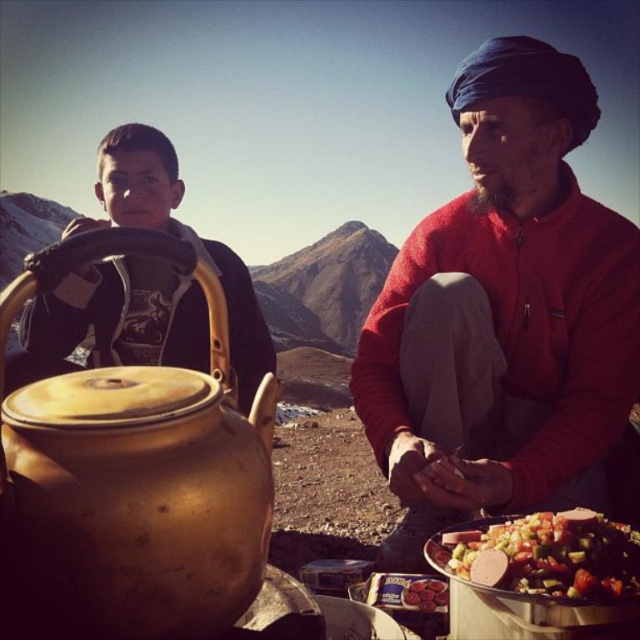
How much distance is there between gold matte teapot at left and matte black jacket at left?

A distance of 3.39 meters exists between gold matte teapot at left and matte black jacket at left.

Between point (20, 412) and point (99, 330), which one is positioned in front?

Positioned in front is point (20, 412).

Where is `gold matte teapot at left`? The image size is (640, 640). gold matte teapot at left is located at coordinates (140, 474).

At what (x,y) coordinates should I click in order to perform the action: click on red wool sweater at center. Please return your answer as a coordinate pair (x, y). Looking at the image, I should click on (x=504, y=314).

Which is more to the right, red wool sweater at center or matte black jacket at left?

red wool sweater at center is more to the right.

Between point (524, 365) and point (209, 353), which one is positioned behind?

Point (209, 353)

You are a GUI agent. You are given a task and a screenshot of the screen. Output one action in this format:
    pyautogui.click(x=<x>, y=<y>)
    Task: Click on the red wool sweater at center
    The image size is (640, 640).
    Given the screenshot: What is the action you would take?
    pyautogui.click(x=504, y=314)

Does red wool sweater at center have a lesser width compared to gold matte teapot at left?

No.

Is red wool sweater at center bigger than gold matte teapot at left?

Correct, red wool sweater at center is larger in size than gold matte teapot at left.

Identify the location of red wool sweater at center. (x=504, y=314).